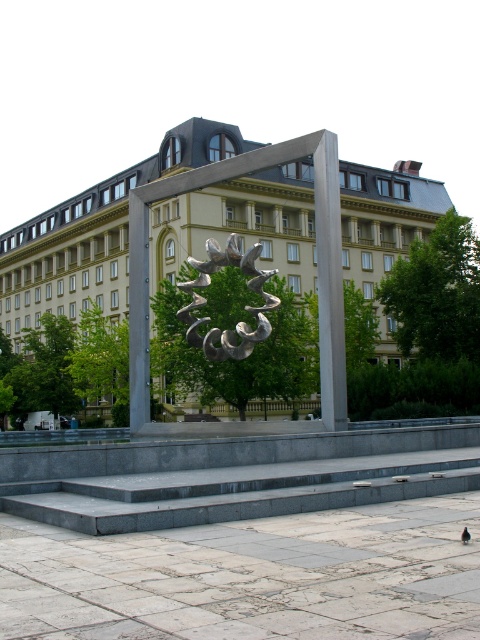
Which is above, satin silver sculpture at center or brown feathered pigeon at center?

Positioned higher is satin silver sculpture at center.

Is point (242, 269) positioned before point (462, 534)?

No, it is not.

The width and height of the screenshot is (480, 640). In order to click on satin silver sculpture at center in this screenshot , I will do `click(244, 307)`.